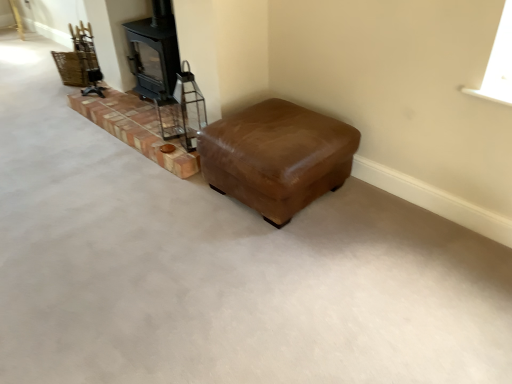
Question: From a real-world perspective, is brown leather ottoman at center under black matte wood burning stove at upper left?

Choices:
 (A) yes
 (B) no

Answer: (A)

Question: Does brown leather ottoman at center have a greater width compared to black matte wood burning stove at upper left?

Choices:
 (A) yes
 (B) no

Answer: (A)

Question: Considering the relative positions of brown leather ottoman at center and black matte wood burning stove at upper left in the image provided, is brown leather ottoman at center in front of black matte wood burning stove at upper left?

Choices:
 (A) yes
 (B) no

Answer: (A)

Question: Can you confirm if brown leather ottoman at center is bigger than black matte wood burning stove at upper left?

Choices:
 (A) no
 (B) yes

Answer: (B)

Question: Does brown leather ottoman at center turn towards black matte wood burning stove at upper left?

Choices:
 (A) no
 (B) yes

Answer: (A)

Question: Does brown leather ottoman at center touch black matte wood burning stove at upper left?

Choices:
 (A) yes
 (B) no

Answer: (B)

Question: Is black matte wood burning stove at upper left wider than brown leather ottoman at center?

Choices:
 (A) no
 (B) yes

Answer: (A)

Question: Is black matte wood burning stove at upper left facing away from brown leather ottoman at center?

Choices:
 (A) no
 (B) yes

Answer: (A)

Question: Does black matte wood burning stove at upper left touch brown leather ottoman at center?

Choices:
 (A) no
 (B) yes

Answer: (A)

Question: Is brown leather ottoman at center surrounded by black matte wood burning stove at upper left?

Choices:
 (A) yes
 (B) no

Answer: (B)

Question: From a real-world perspective, is black matte wood burning stove at upper left on top of brown leather ottoman at center?

Choices:
 (A) no
 (B) yes

Answer: (B)

Question: Does black matte wood burning stove at upper left come behind brown leather ottoman at center?

Choices:
 (A) no
 (B) yes

Answer: (B)

Question: Could you tell me if brick at left is turned towards black matte wood burning stove at upper left?

Choices:
 (A) yes
 (B) no

Answer: (B)